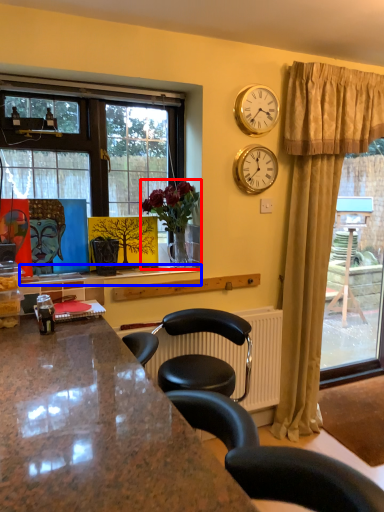
Question: Among these objects, which one is nearest to the camera, houseplant (highlighted by a red box) or window sill (highlighted by a blue box)?

Choices:
 (A) houseplant
 (B) window sill

Answer: (B)